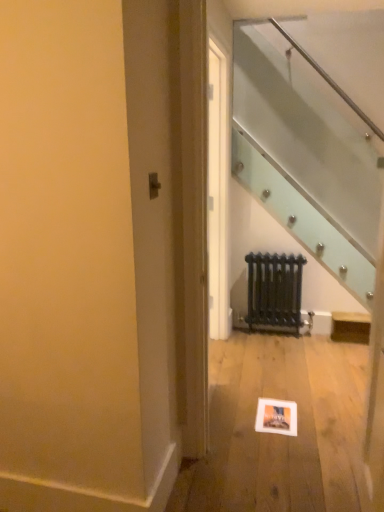
Question: Considering their positions, is matte orange picture frame at lower center located in front of or behind black metal radiator at center?

Choices:
 (A) behind
 (B) front

Answer: (B)

Question: Looking at their shapes, would you say matte orange picture frame at lower center is wider or thinner than black metal radiator at center?

Choices:
 (A) thin
 (B) wide

Answer: (B)

Question: From the image's perspective, is matte orange picture frame at lower center positioned above or below black metal radiator at center?

Choices:
 (A) above
 (B) below

Answer: (B)

Question: Considering the positions of point (256, 294) and point (276, 431), is point (256, 294) closer or farther from the camera than point (276, 431)?

Choices:
 (A) closer
 (B) farther

Answer: (B)

Question: Relative to matte orange picture frame at lower center, is black metal radiator at center in front or behind?

Choices:
 (A) behind
 (B) front

Answer: (A)

Question: Visually, is black metal radiator at center positioned to the left or to the right of matte orange picture frame at lower center?

Choices:
 (A) right
 (B) left

Answer: (A)

Question: From the image's perspective, is black metal radiator at center positioned above or below matte orange picture frame at lower center?

Choices:
 (A) below
 (B) above

Answer: (B)